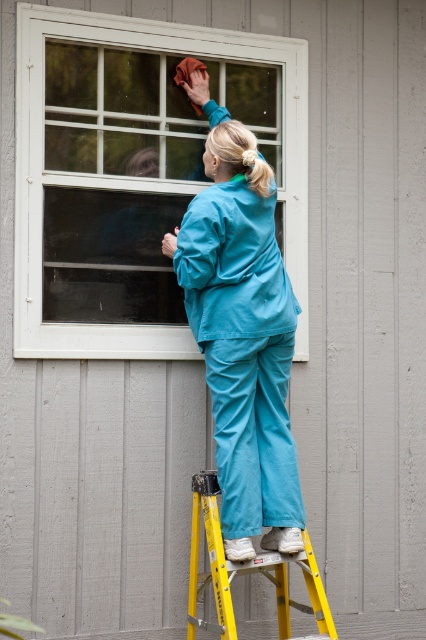
You are a safety inspector checking the setup of the teal fabric pants at center and the yellow metallic ladder at lower center. According to safety regulations, the minimum safe distance between a worker and a ladder should be at least 12 inches. Is the current distance compliant with the regulation?

The teal fabric pants at center and yellow metallic ladder at lower center are 12.13 inches apart, which meets the minimum requirement of 12 inches, so it is compliant with the safety regulation.

You are a safety inspector checking the setup for a window cleaning operation. You notice the white matte window at upper center and the teal fabric pants at center. Based on their positions, is the worker standing on the ladder below the window?

Yes, the worker is standing on the ladder below the window because the white matte window at upper center is positioned over the teal fabric pants at center, indicating the window is above the worker.

You are a safety inspector reviewing this scene. You need to determine if the worker in teal fabric pants at center is standing on the yellow metallic ladder at lower center. Based on their heights, can you confirm this?

The teal fabric pants at center is taller than yellow metallic ladder at lower center, so the worker cannot be standing on the ladder since the worker is taller than the ladder itself.